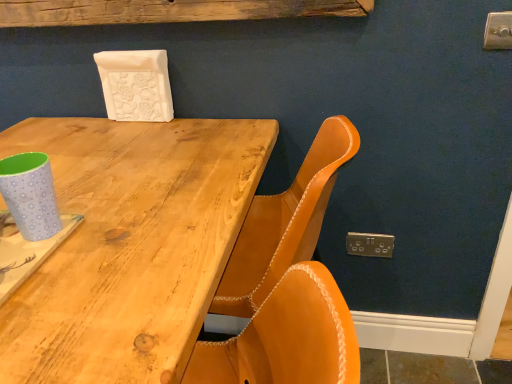
Question: From the image's perspective, would you say natural wood table at center is shown under light blue polka dot paper cup at left?

Choices:
 (A) yes
 (B) no

Answer: (A)

Question: Would you say natural wood table at center is a long distance from light blue polka dot paper cup at left?

Choices:
 (A) no
 (B) yes

Answer: (A)

Question: Could you tell me if natural wood table at center is turned towards light blue polka dot paper cup at left?

Choices:
 (A) no
 (B) yes

Answer: (A)

Question: Is natural wood table at center located outside light blue polka dot paper cup at left?

Choices:
 (A) no
 (B) yes

Answer: (B)

Question: Can you confirm if natural wood table at center is taller than light blue polka dot paper cup at left?

Choices:
 (A) no
 (B) yes

Answer: (B)

Question: Is natural wood table at center further to the viewer compared to light blue polka dot paper cup at left?

Choices:
 (A) no
 (B) yes

Answer: (A)

Question: Is gold metallic electric outlet at lower right at the back of natural wood table at center?

Choices:
 (A) yes
 (B) no

Answer: (B)

Question: Is natural wood table at center bigger than gold metallic electric outlet at lower right?

Choices:
 (A) yes
 (B) no

Answer: (A)

Question: Can you confirm if natural wood table at center is shorter than gold metallic electric outlet at lower right?

Choices:
 (A) no
 (B) yes

Answer: (A)

Question: Does natural wood table at center appear on the right side of gold metallic electric outlet at lower right?

Choices:
 (A) yes
 (B) no

Answer: (B)

Question: From the image's perspective, is natural wood table at center located above gold metallic electric outlet at lower right?

Choices:
 (A) no
 (B) yes

Answer: (A)

Question: Is natural wood table at center smaller than gold metallic electric outlet at lower right?

Choices:
 (A) no
 (B) yes

Answer: (A)

Question: Is rustic wood plank at upper center behind natural wood table at center?

Choices:
 (A) no
 (B) yes

Answer: (B)